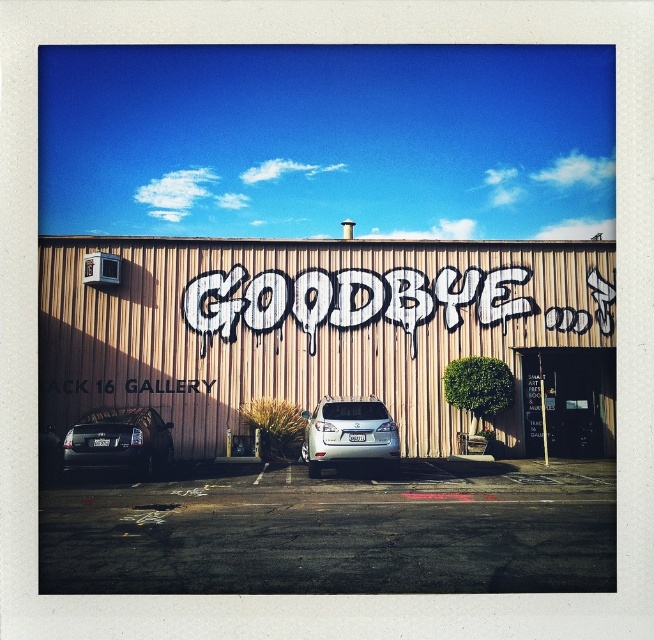
Is shiny black sedan at lower left bigger than satin silver suv at center?

Indeed, shiny black sedan at lower left has a larger size compared to satin silver suv at center.

Find the location of a particular element. shiny black sedan at lower left is located at coordinates [x=118, y=442].

Who is more distant from viewer, (105, 429) or (390, 467)?

Point (390, 467)

Find the location of a particular element. This screenshot has height=640, width=654. shiny black sedan at lower left is located at coordinates (118, 442).

Based on the photo, can you confirm if white graffiti at center is positioned to the left of satin silver suv at center?

No, white graffiti at center is not to the left of satin silver suv at center.

Is point (262, 304) behind point (337, 410)?

Yes, point (262, 304) is behind point (337, 410).

I want to click on white graffiti at center, so click(x=351, y=300).

Does white graffiti at center have a lesser width compared to shiny black sedan at lower left?

No.

Does white graffiti at center come in front of shiny black sedan at lower left?

No, it is not.

The height and width of the screenshot is (640, 654). I want to click on white graffiti at center, so click(351, 300).